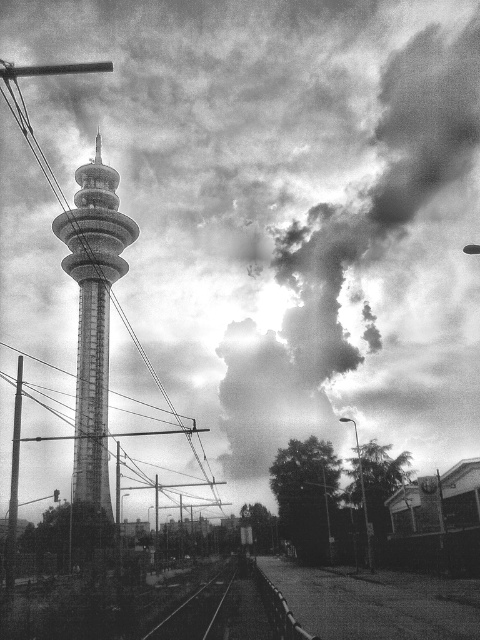
You are a drone operator trying to navigate between two points in the urban scene. The first point is point (98,147) and the second is point (235,561). According to the image, which point is closer to the observer?

Point (235,561) is closer to the observer because point (98,147) is behind it.

You are a photographer standing in the middle of the scene. You notice the smooth wire at center and the smooth metallic tower at center. Which object is located to the left of the other?

The smooth wire at center is positioned on the left side of the smooth metallic tower at center.

You are a surveyor measuring distances in the image. You need to determine if the distance between the smooth wire at center and the smooth metal train track at lower center is more than 300 feet. What is your conclusion?

The smooth wire at center and smooth metal train track at lower center are 347.05 feet apart, which is more than 300 feet. Therefore, the distance is indeed greater than 300 feet.